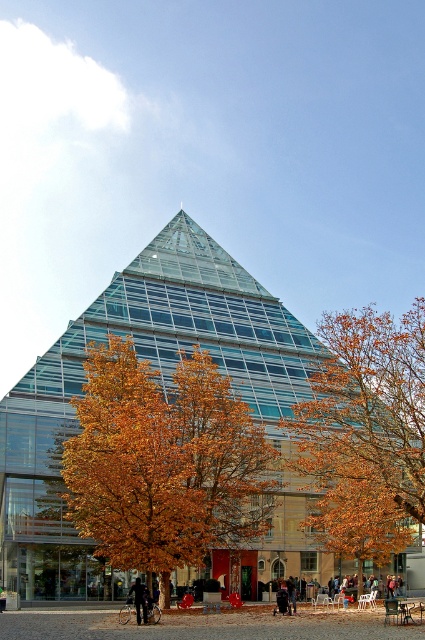
Question: Which of the following is the closest to the observer?

Choices:
 (A) transparent glass pyramid at center
 (B) orange leafy tree at center
 (C) black leather jacket at center

Answer: (C)

Question: Is golden leafy tree at center bigger than orange leafy tree at center?

Choices:
 (A) no
 (B) yes

Answer: (A)

Question: From the image, what is the correct spatial relationship of transparent glass pyramid at center in relation to black leather jacket at center?

Choices:
 (A) above
 (B) below

Answer: (A)

Question: Which of the following is the farthest from the observer?

Choices:
 (A) transparent glass pyramid at center
 (B) golden leafy tree at center

Answer: (A)

Question: Based on their relative distances, which object is farther from the orange leafy tree at center?

Choices:
 (A) golden leafy tree at center
 (B) transparent glass pyramid at center

Answer: (B)

Question: Does orange leafy tree at center have a larger size compared to black leather jacket at center?

Choices:
 (A) yes
 (B) no

Answer: (A)